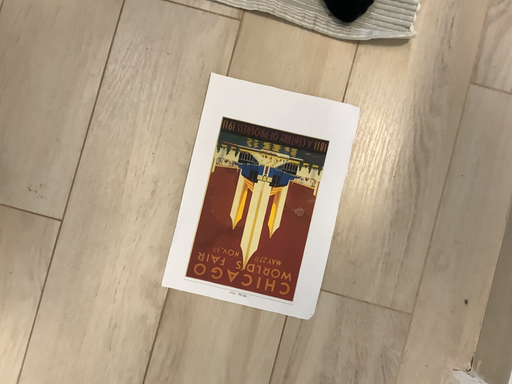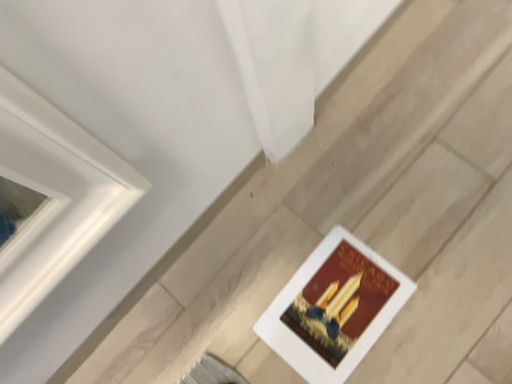
Question: Which way did the camera rotate in the video?

Choices:
 (A) rotated right
 (B) rotated left

Answer: (B)